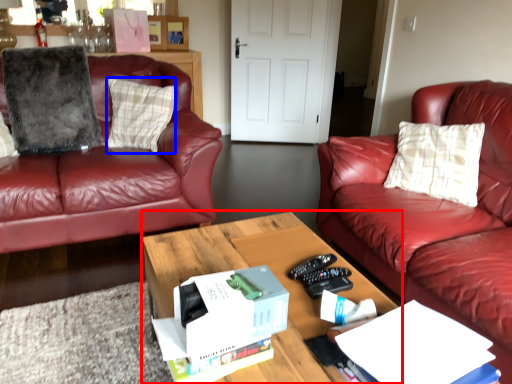
Question: Which object is closer to the camera taking this photo, coffee table (highlighted by a red box) or pillow (highlighted by a blue box)?

Choices:
 (A) coffee table
 (B) pillow

Answer: (A)